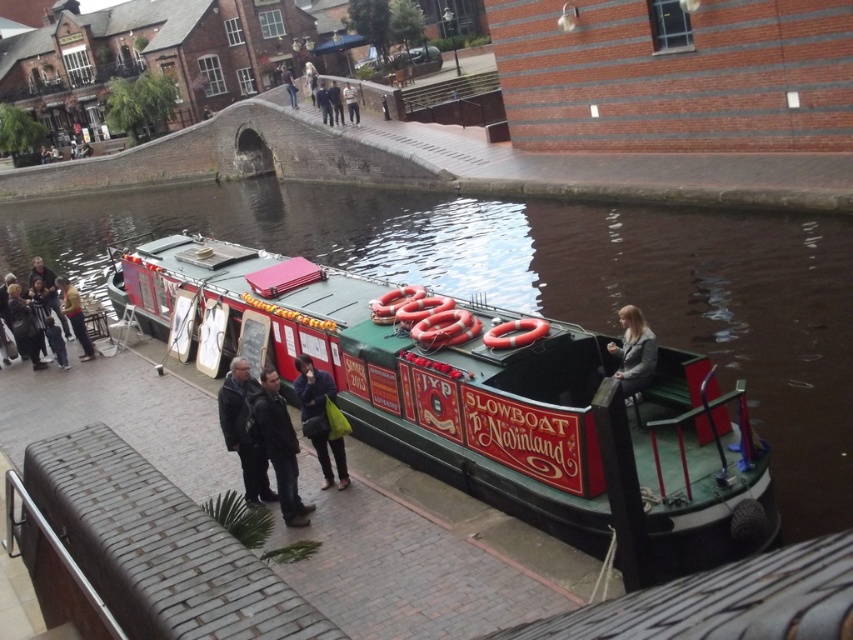
Question: Among these points, which one is nearest to the camera?

Choices:
 (A) (322, 92)
 (B) (489, 492)
 (C) (76, 291)

Answer: (B)

Question: Which object is farther from the camera taking this photo?

Choices:
 (A) dark gray leather jacket at center
 (B) green painted wood boat at center
 (C) light blue jeans at center

Answer: (C)

Question: Among these points, which one is farthest from the camera?

Choices:
 (A) (268, 500)
 (B) (271, 456)
 (C) (334, 99)
 (D) (323, 97)

Answer: (D)

Question: Does brick dock at lower left appear on the left side of matte black camera at left?

Choices:
 (A) no
 (B) yes

Answer: (A)

Question: Does gray fabric jacket at upper right appear under yellow jacket at left?

Choices:
 (A) no
 (B) yes

Answer: (B)

Question: Can you confirm if matte black jacket at lower left is bigger than dark brown leather jacket at center?

Choices:
 (A) yes
 (B) no

Answer: (B)